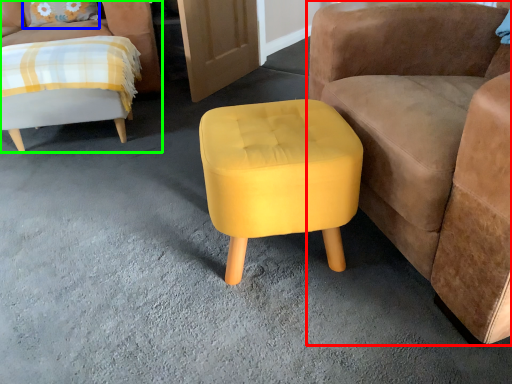
Question: Which object is positioned closest to chair (highlighted by a red box)? Select from pillow (highlighted by a blue box) and chair (highlighted by a green box).

Choices:
 (A) pillow
 (B) chair

Answer: (B)